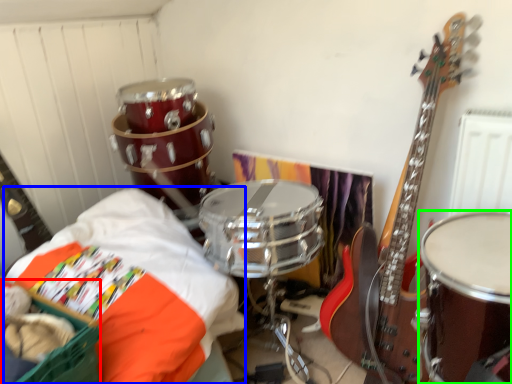
Question: Estimate the real-world distances between objects in this image. Which object is farther from basket (highlighted by a red box), sheet (highlighted by a blue box) or drum (highlighted by a green box)?

Choices:
 (A) sheet
 (B) drum

Answer: (B)